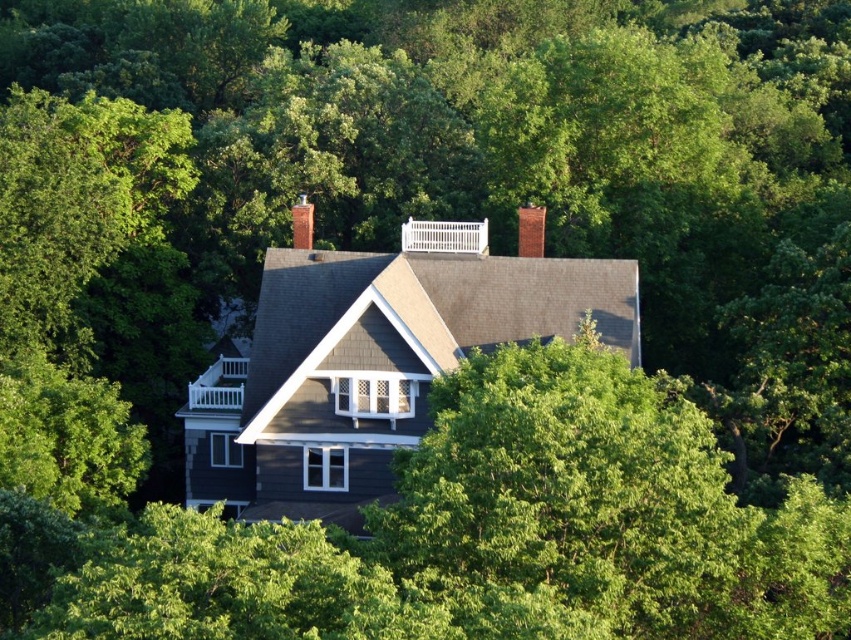
In the scene shown: You are an architect reviewing the house design. You notice two chimneys on the roof. Which one is narrower in width between the red brick chimney at upper center and the brick chimney at center?

The red brick chimney at upper center is narrower in width compared to the brick chimney at center.